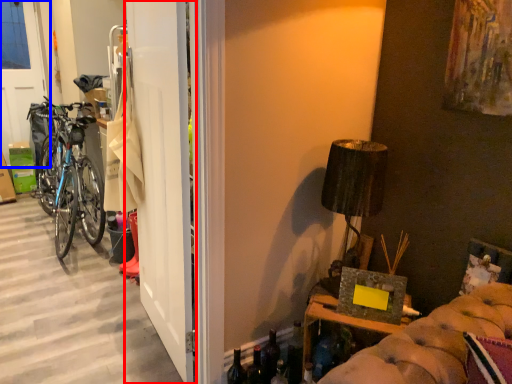
Question: Among these objects, which one is nearest to the camera, door (highlighted by a red box) or screen door (highlighted by a blue box)?

Choices:
 (A) door
 (B) screen door

Answer: (A)